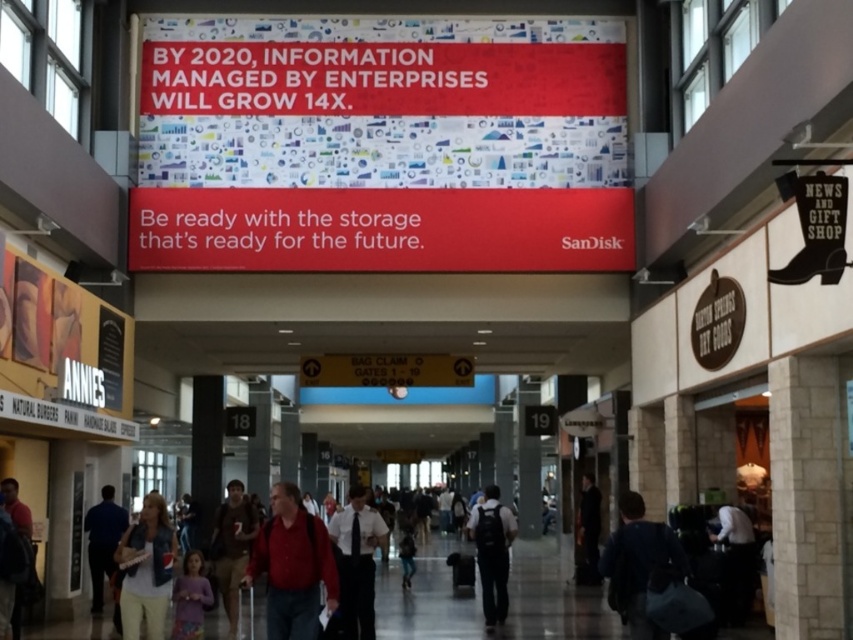
Question: Among these objects, which one is nearest to the camera?

Choices:
 (A) dark fabric jacket at center
 (B) red fabric shirt at center
 (C) white shirt at lower right

Answer: (B)

Question: Which point appears closest to the camera in this image?

Choices:
 (A) (619, 531)
 (B) (350, 577)
 (C) (239, 538)
 (D) (285, 564)

Answer: (A)

Question: Can you confirm if dark blue backpack at lower right is thinner than white shirt at center?

Choices:
 (A) yes
 (B) no

Answer: (A)

Question: Does matte purple shirt at lower left have a lesser width compared to dark fabric jacket at center?

Choices:
 (A) yes
 (B) no

Answer: (B)

Question: Is white shirt at center to the left of brown cotton shirt at lower left from the viewer's perspective?

Choices:
 (A) yes
 (B) no

Answer: (B)

Question: Considering the real-world distances, which object is closest to the denim jacket at lower left?

Choices:
 (A) white shirt at lower right
 (B) white shirt at center
 (C) dark blue backpack at center
 (D) matte purple shirt at lower left

Answer: (D)